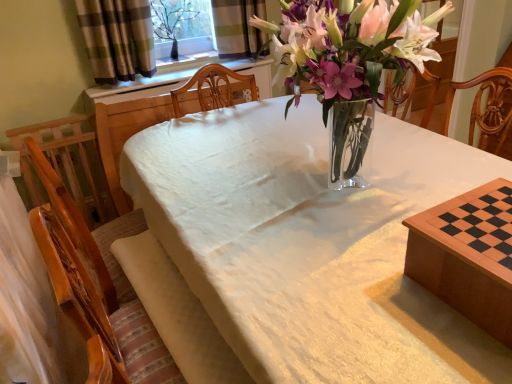
Question: From a real-world perspective, is plaid fabric curtain at upper left over wooden chessboard at lower right, the 1th table positioned from the back?

Choices:
 (A) yes
 (B) no

Answer: (A)

Question: Is plaid fabric curtain at upper left taller than wooden chessboard at lower right, the 1th table positioned from the back?

Choices:
 (A) yes
 (B) no

Answer: (A)

Question: Is plaid fabric curtain at upper left at the left side of wooden chessboard at lower right, the 1th table positioned from the back?

Choices:
 (A) no
 (B) yes

Answer: (B)

Question: Considering the relative sizes of plaid fabric curtain at upper left and wooden chessboard at lower right, the 1th table positioned from the back, in the image provided, is plaid fabric curtain at upper left bigger than wooden chessboard at lower right, the 1th table positioned from the back,?

Choices:
 (A) no
 (B) yes

Answer: (B)

Question: Can you confirm if plaid fabric curtain at upper left is smaller than wooden chessboard at lower right, the 2th table in the front-to-back sequence?

Choices:
 (A) no
 (B) yes

Answer: (A)

Question: Does plaid fabric curtain at upper left contain wooden chessboard at lower right, the 1th table positioned from the back?

Choices:
 (A) yes
 (B) no

Answer: (B)

Question: Is white cloth at center, which appears as the second table when viewed from the back, beside wooden chessboard at lower right, the 1th table positioned from the back?

Choices:
 (A) yes
 (B) no

Answer: (B)

Question: Is the depth of white cloth at center, the first table when ordered from front to back, greater than that of wooden chessboard at lower right, the 2th table in the front-to-back sequence?

Choices:
 (A) yes
 (B) no

Answer: (B)

Question: From the image's perspective, is white cloth at center, the first table when ordered from front to back, under wooden chessboard at lower right, the 1th table positioned from the back?

Choices:
 (A) no
 (B) yes

Answer: (B)

Question: From the image's perspective, is white cloth at center, which appears as the second table when viewed from the back, on top of wooden chessboard at lower right, the 1th table positioned from the back?

Choices:
 (A) no
 (B) yes

Answer: (A)

Question: From a real-world perspective, does white cloth at center, the first table when ordered from front to back, stand above wooden chessboard at lower right, the 2th table in the front-to-back sequence?

Choices:
 (A) yes
 (B) no

Answer: (B)

Question: Is white cloth at center, which appears as the second table when viewed from the back, looking in the opposite direction of wooden chessboard at lower right, the 2th table in the front-to-back sequence?

Choices:
 (A) yes
 (B) no

Answer: (B)

Question: Could you tell me if wooden chessboard at lower right, the 1th table positioned from the back, is turned towards plaid fabric curtain at upper left?

Choices:
 (A) yes
 (B) no

Answer: (B)